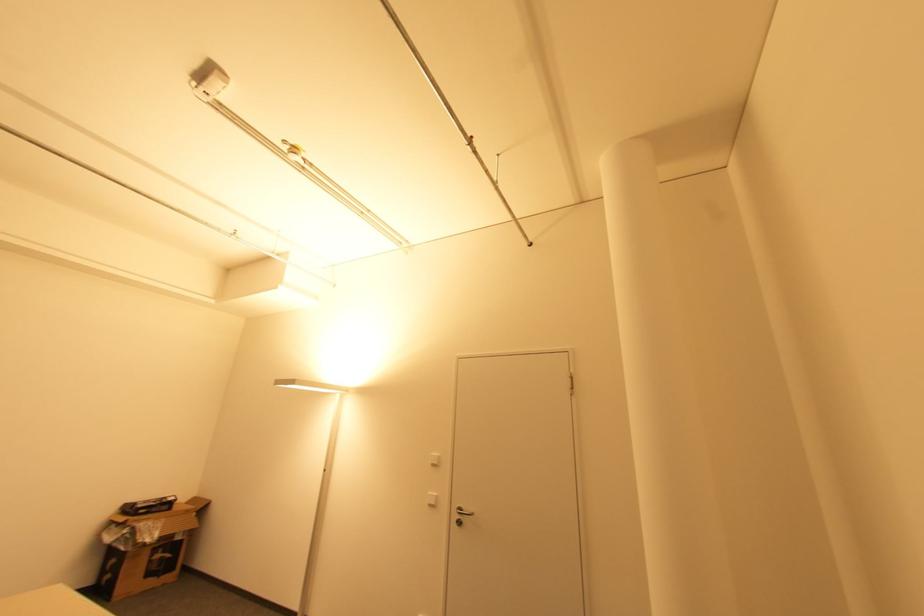
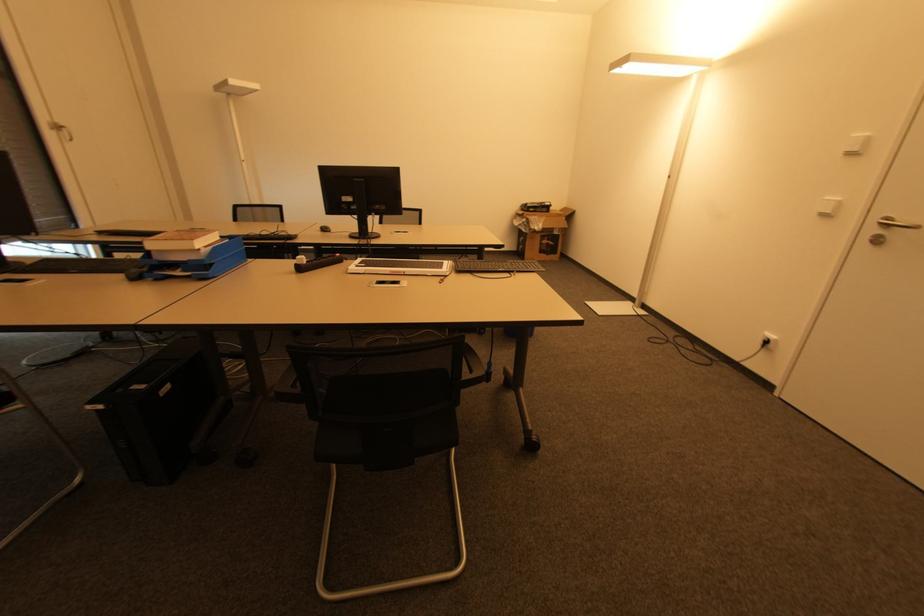
The images are taken continuously from a first-person perspective. In which direction is your viewpoint rotating?

The camera's rotation is toward left-down.